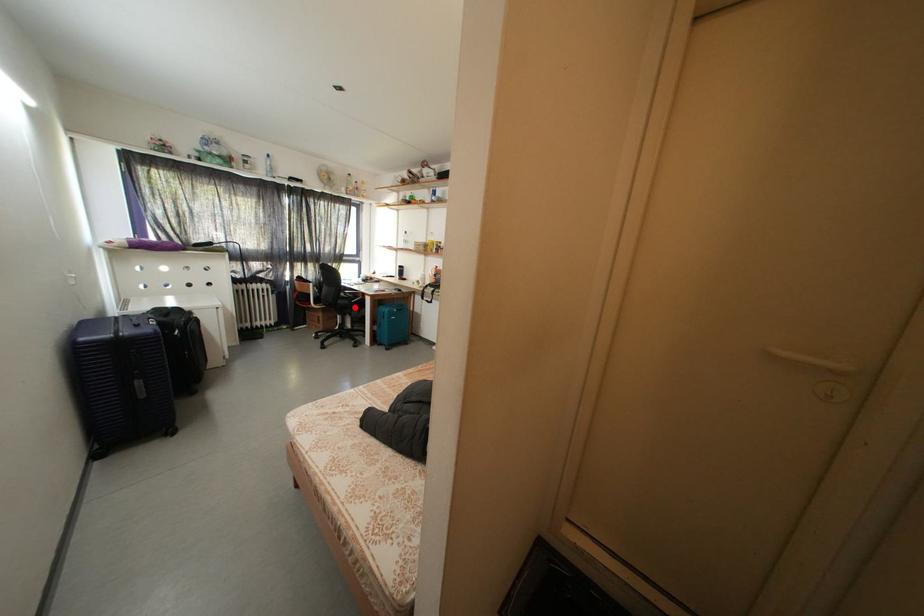
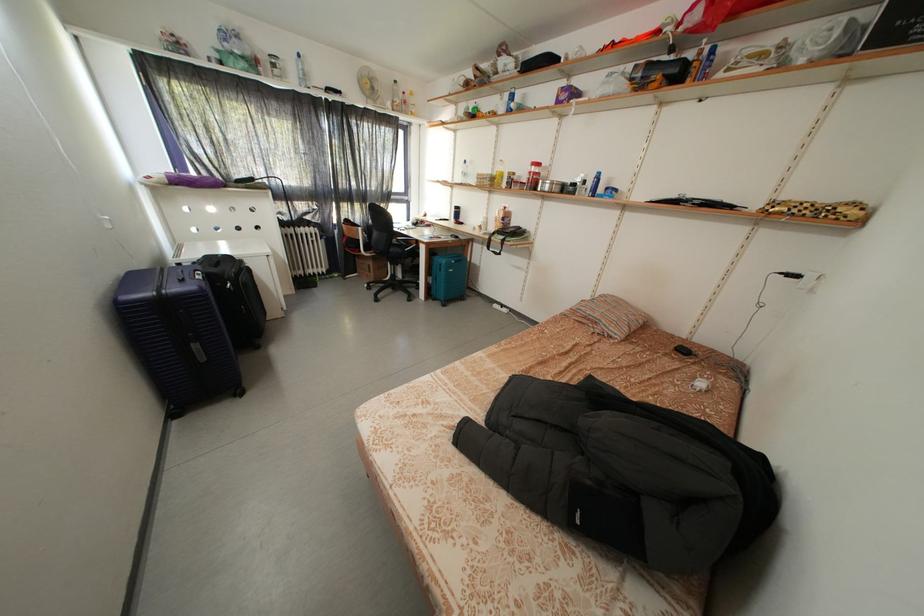
Question: A red point is marked in image1. In image2, is the corresponding 3D point closer to the camera or farther? Reply with the corresponding letter.

Choices:
 (A) The corresponding 3D point is closer.
 (B) The corresponding 3D point is farther.

Answer: (A)